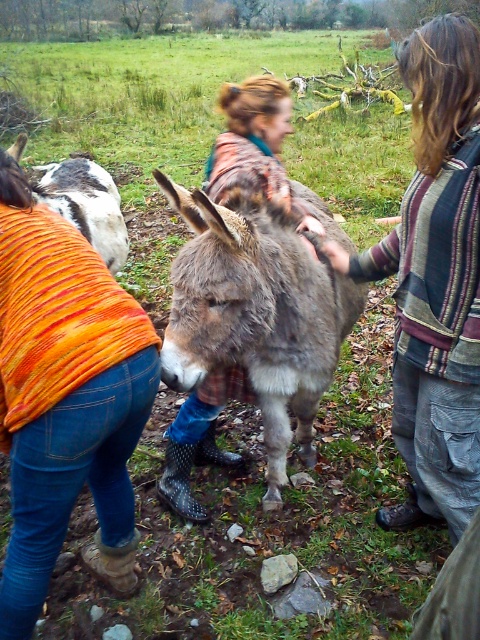
You are standing at the point marked by the coordinates point (64, 397). Looking around, you see an orange knitted sweater at lower left and a dark green plaid shirt at upper right. Which clothing item is closer to your current position?

The orange knitted sweater at lower left is closer to your current position at point (64, 397) because the point is on the orange knitted sweater at lower left.

You are standing in the field and see the striped wool sweater at center and the white fur donkey at left. Which object is positioned lower in the image?

The striped wool sweater at center is located below the white fur donkey at left, so the striped wool sweater at center is positioned lower in the image.

You are a photographer trying to capture a group photo of the striped wool sweater at center and the white fur donkey at left. If you want both subjects to appear equally sized in the photo, what should you do?

Since the striped wool sweater at center is smaller than the white fur donkey at left, you should move closer to the striped wool sweater at center and farther from the white fur donkey at left to make them appear the same size in the photo.